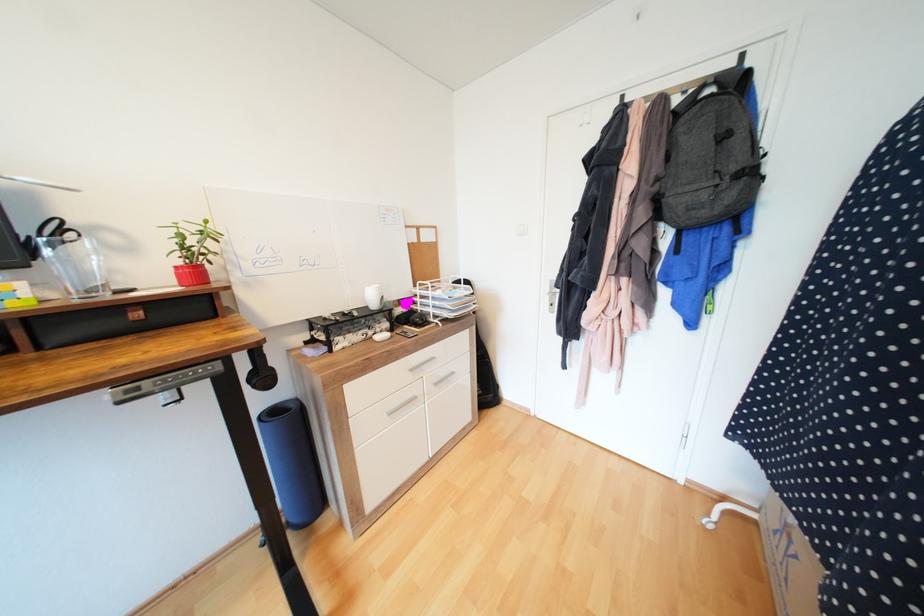
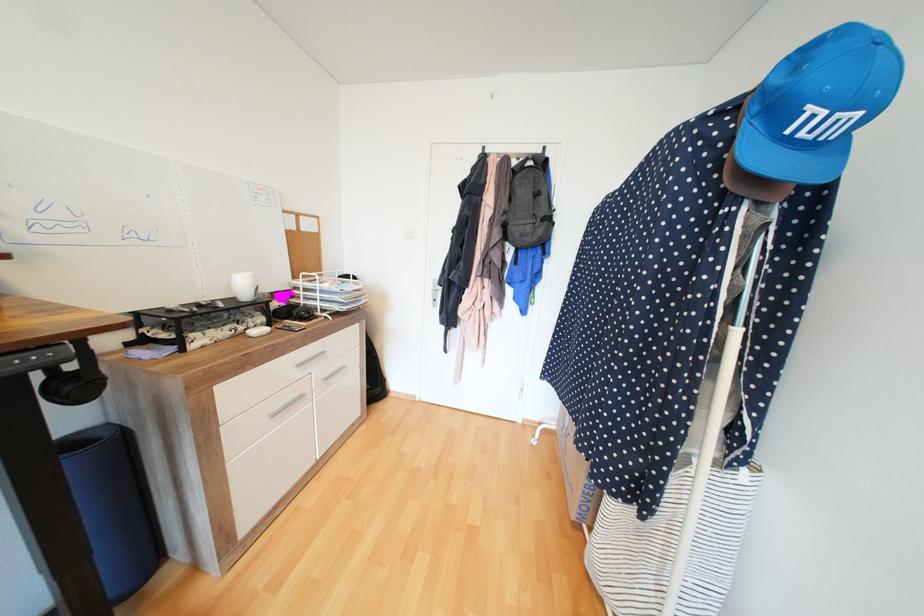
Where in the second image is the point corresponding to point (281, 411) from the first image?

(80, 443)